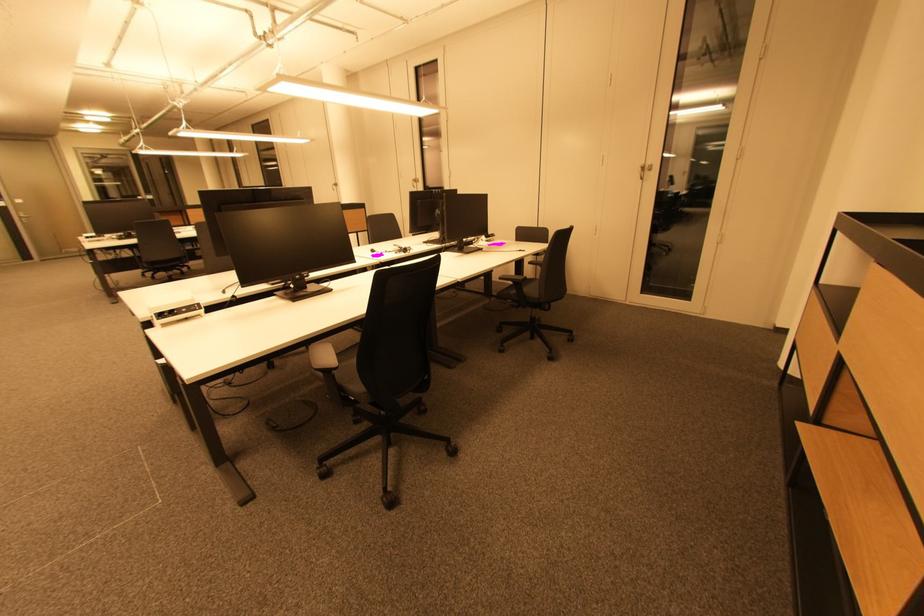
Describe the element at coordinates (176, 312) in the screenshot. I see `a white electronic device` at that location.